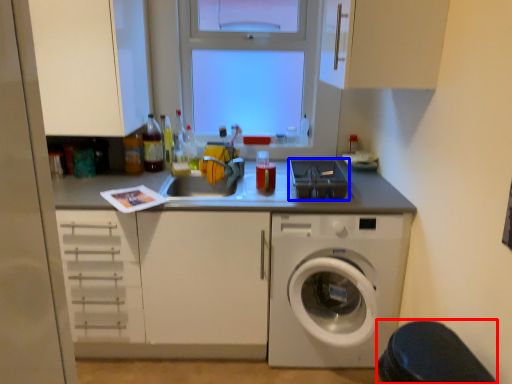
Question: Which of the following is the closest to the observer, step stool (highlighted by a red box) or appliance (highlighted by a blue box)?

Choices:
 (A) step stool
 (B) appliance

Answer: (A)